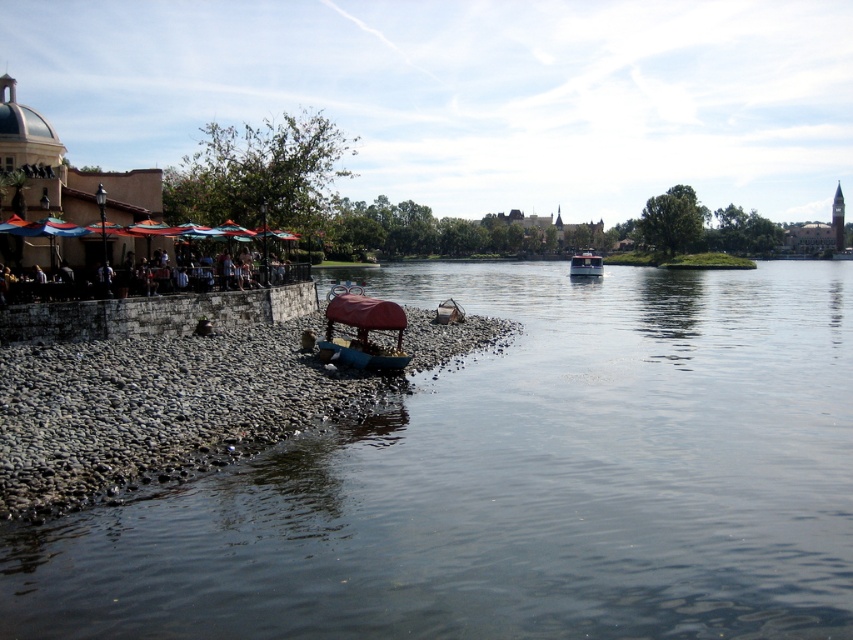
You are standing on the smooth stone river at lower left and want to board the metallic red boat at center. Which direction should you move to reach the boat?

You should move upward to reach the metallic red boat at center because the smooth stone river at lower left is located below it.

You are a person sitting on the dark brown wooden bench at left. You want to move to the blue plastic boat at lower left. Can you move sideways without getting up from the bench?

The dark brown wooden bench at left might be wider than blue plastic boat at lower left, so there is a possibility that the bench is wider. If the bench is indeed wider, moving sideways might be possible, but since the exact width of the boat isn